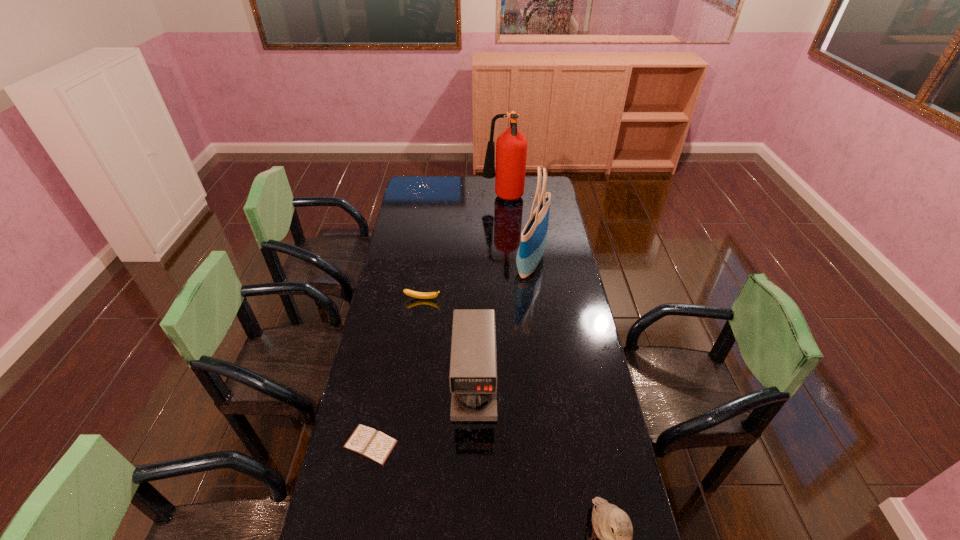
This screenshot has width=960, height=540. Find the location of `vacant area situated 0.140m on the left of the tote bag`. vacant area situated 0.140m on the left of the tote bag is located at coordinates (484, 264).

Where is `free spot located 0.140m on the carafe side of the third nearest object`? free spot located 0.140m on the carafe side of the third nearest object is located at coordinates (473, 465).

You are a GUI agent. You are given a task and a screenshot of the screen. Output one action in this format:
    pyautogui.click(x=<x>, y=<y>)
    Task: Click on the free space located at the stem of the banana
    This screenshot has height=540, width=960.
    Given the screenshot: What is the action you would take?
    pyautogui.click(x=420, y=312)

Find the location of a particular element. vacant space situated 0.090m on the front of the shortest object is located at coordinates (361, 497).

The height and width of the screenshot is (540, 960). Find the location of `object that is at the far edge`. object that is at the far edge is located at coordinates (511, 147).

Find the location of a particular element. This screenshot has height=540, width=960. banana that is at the left edge is located at coordinates (421, 295).

The image size is (960, 540). I want to click on diary present at the left edge, so click(x=375, y=445).

Locate an element on the screen. object present at the right edge is located at coordinates (534, 236).

Where is `free space at the left edge of the desktop`? The height and width of the screenshot is (540, 960). free space at the left edge of the desktop is located at coordinates (416, 277).

The width and height of the screenshot is (960, 540). In order to click on free space at the right edge of the desktop in this screenshot , I will do `click(562, 299)`.